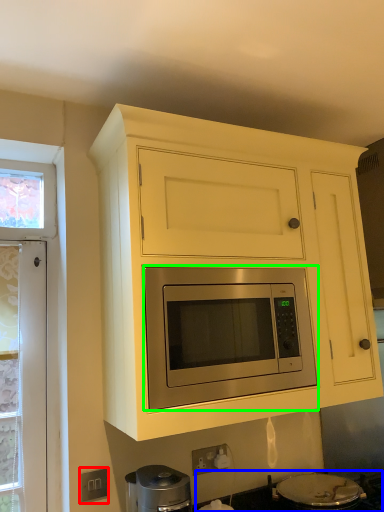
Question: Considering the real-world distances, which object is closest to electric outlet (highlighted by a red box)? gas stove (highlighted by a blue box) or microwave oven (highlighted by a green box).

Choices:
 (A) gas stove
 (B) microwave oven

Answer: (B)